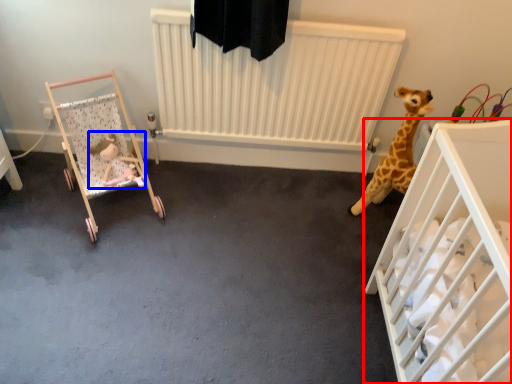
Question: Which point is closer to the camera, infant bed (highlighted by a red box) or toy (highlighted by a blue box)?

Choices:
 (A) infant bed
 (B) toy

Answer: (A)